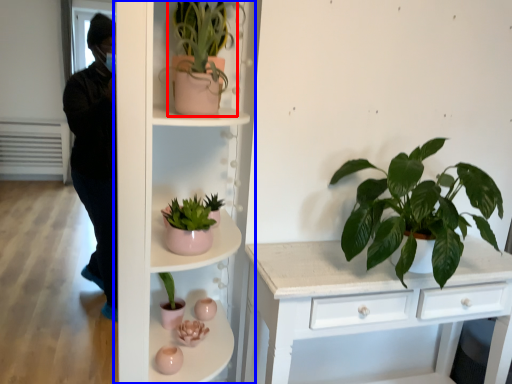
Question: Which of the following is the closest to the observer, houseplant (highlighted by a red box) or shelf (highlighted by a blue box)?

Choices:
 (A) houseplant
 (B) shelf

Answer: (B)